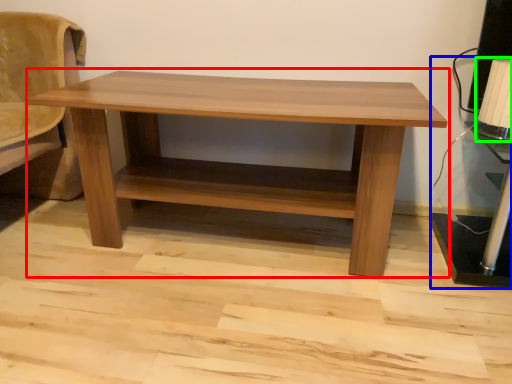
Question: Which is farther away from table (highlighted by a red box)? table lamp (highlighted by a blue box) or table lamp (highlighted by a green box)?

Choices:
 (A) table lamp
 (B) table lamp

Answer: (B)